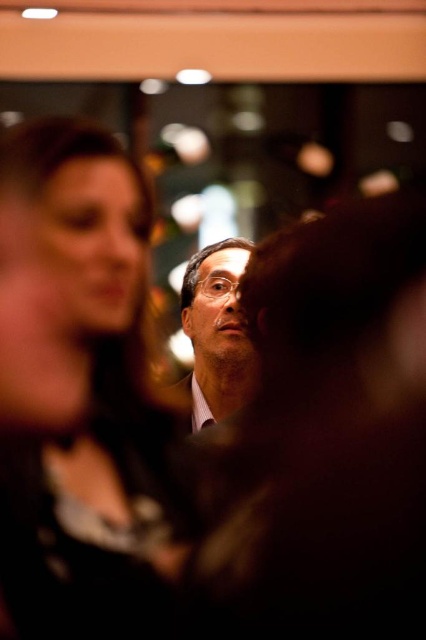
Can you confirm if matte black dress at upper left is positioned to the left of matte black glasses at center?

Indeed, matte black dress at upper left is positioned on the left side of matte black glasses at center.

Can you confirm if matte black dress at upper left is positioned below matte black glasses at center?

Yes.

Locate an element on the screen. matte black dress at upper left is located at coordinates (81, 397).